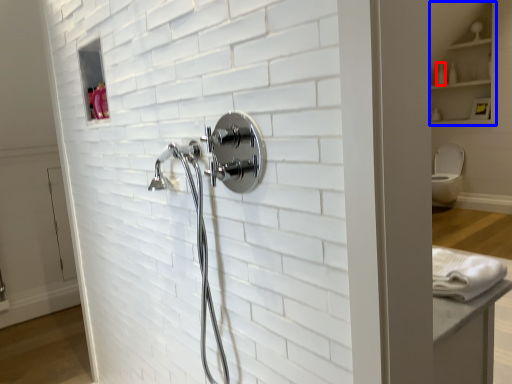
Question: Which object is further to the camera taking this photo, toiletry (highlighted by a red box) or cabinet (highlighted by a blue box)?

Choices:
 (A) toiletry
 (B) cabinet

Answer: (A)